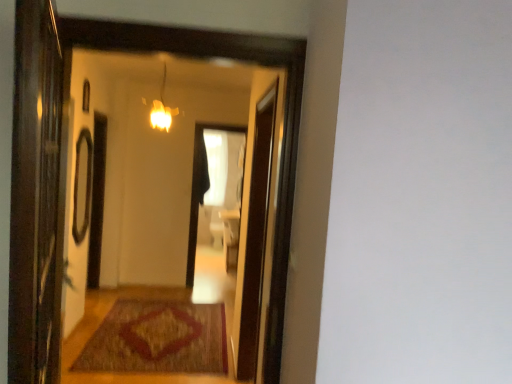
Question: Considering the relative positions of brown woven mat at center and matte wooden mirror at center in the image provided, is brown woven mat at center behind matte wooden mirror at center?

Choices:
 (A) yes
 (B) no

Answer: (A)

Question: From the image's perspective, does brown woven mat at center appear lower than matte wooden mirror at center?

Choices:
 (A) no
 (B) yes

Answer: (B)

Question: Can you confirm if brown woven mat at center is taller than matte wooden mirror at center?

Choices:
 (A) yes
 (B) no

Answer: (B)

Question: Can you confirm if brown woven mat at center is positioned to the left of matte wooden mirror at center?

Choices:
 (A) no
 (B) yes

Answer: (B)

Question: Are brown woven mat at center and matte wooden mirror at center located far from each other?

Choices:
 (A) yes
 (B) no

Answer: (A)

Question: Is brown woven mat at center oriented away from matte wooden mirror at center?

Choices:
 (A) no
 (B) yes

Answer: (A)

Question: From the image's perspective, is matte glass light fixture at upper center over matte wooden mirror at center?

Choices:
 (A) no
 (B) yes

Answer: (B)

Question: Does matte glass light fixture at upper center have a greater height compared to matte wooden mirror at center?

Choices:
 (A) no
 (B) yes

Answer: (A)

Question: Considering the relative sizes of matte glass light fixture at upper center and matte wooden mirror at center in the image provided, is matte glass light fixture at upper center bigger than matte wooden mirror at center?

Choices:
 (A) no
 (B) yes

Answer: (A)

Question: Does matte glass light fixture at upper center appear on the left side of matte wooden mirror at center?

Choices:
 (A) yes
 (B) no

Answer: (A)

Question: Would you consider matte glass light fixture at upper center to be distant from matte wooden mirror at center?

Choices:
 (A) no
 (B) yes

Answer: (A)

Question: Is matte glass light fixture at upper center behind matte wooden mirror at center?

Choices:
 (A) no
 (B) yes

Answer: (B)

Question: From a real-world perspective, is matte glass window at upper left physically above brown woven mat at center?

Choices:
 (A) no
 (B) yes

Answer: (B)